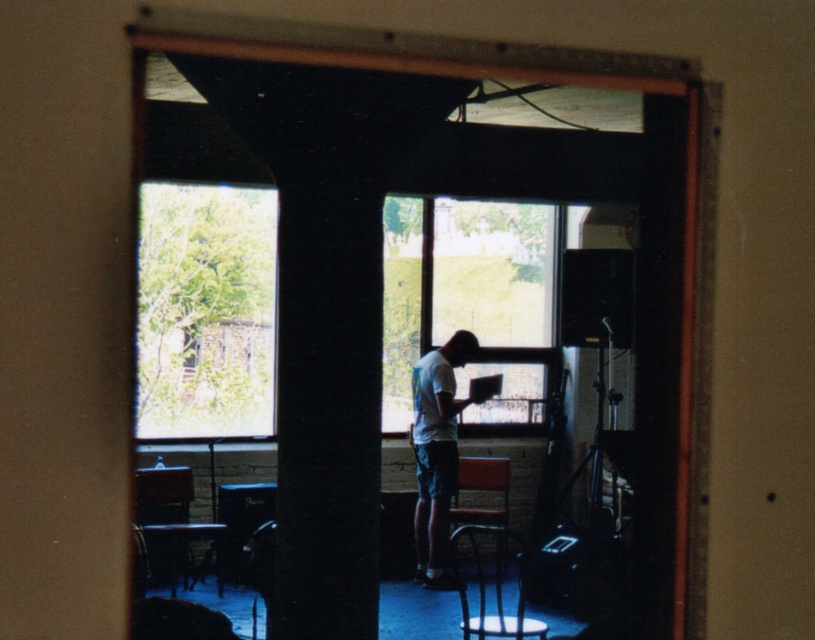
You are standing at the doorway and want to place a 1.5 meter long ladder between the green leafy tree at upper left and the person. Is there enough space?

The distance between the green leafy tree at upper left and the person is 7.94 meters. Since the ladder is only 1.5 meters long, there is more than enough space to place it between them.